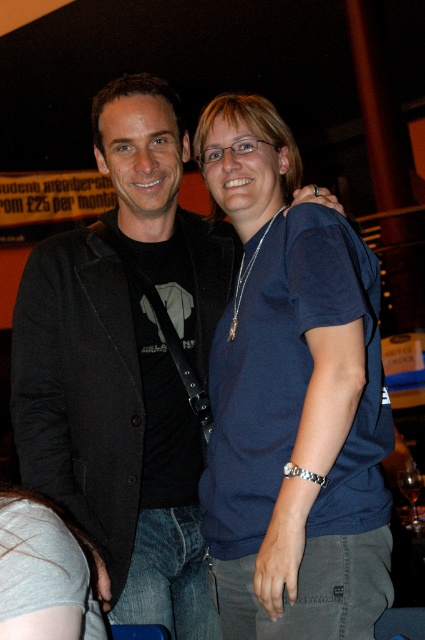
Question: Which of these objects is positioned farthest from the blue cotton shirt at center?

Choices:
 (A) black matte jacket at center
 (B) gray cotton shirt at lower left

Answer: (B)

Question: Does blue cotton shirt at center appear on the left side of black matte jacket at center?

Choices:
 (A) yes
 (B) no

Answer: (B)

Question: Does blue cotton shirt at center have a larger size compared to gray cotton shirt at lower left?

Choices:
 (A) yes
 (B) no

Answer: (A)

Question: Can you confirm if black matte jacket at center is positioned to the left of gray cotton shirt at lower left?

Choices:
 (A) no
 (B) yes

Answer: (A)

Question: Estimate the real-world distances between objects in this image. Which object is farther from the gray cotton shirt at lower left?

Choices:
 (A) blue cotton shirt at center
 (B) black matte jacket at center

Answer: (A)

Question: Which of the following is the farthest from the observer?

Choices:
 (A) gray cotton shirt at lower left
 (B) black matte jacket at center

Answer: (B)